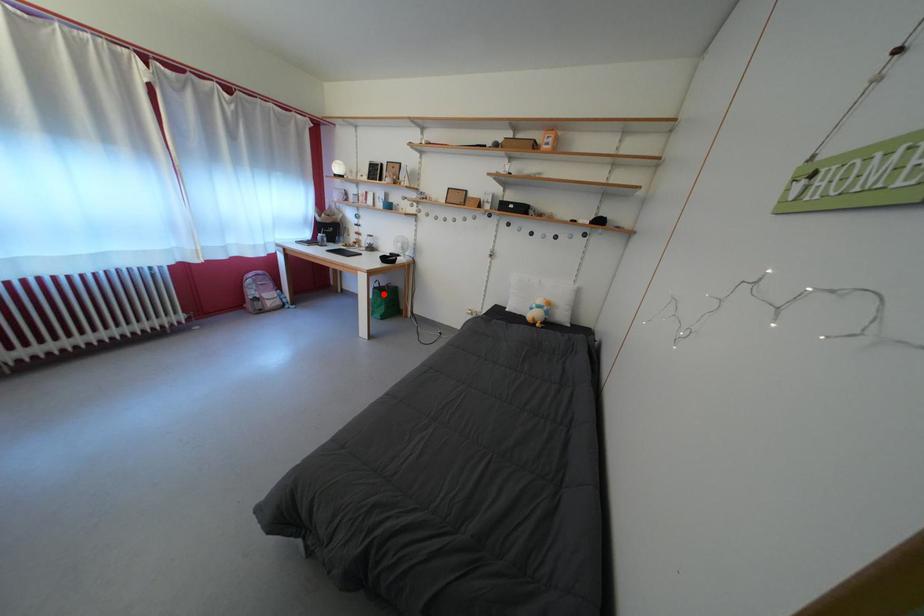
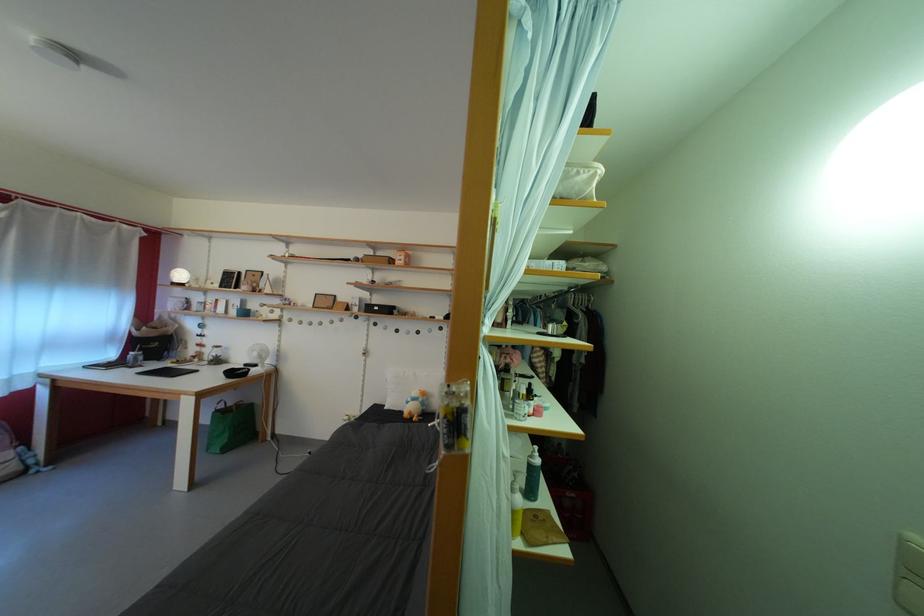
Question: I am providing you with two images of the same scene from different viewpoints. A red point is shown in image1. For the corresponding object point in image2, is it positioned nearer or farther from the camera?

Choices:
 (A) Nearer
 (B) Farther

Answer: (B)